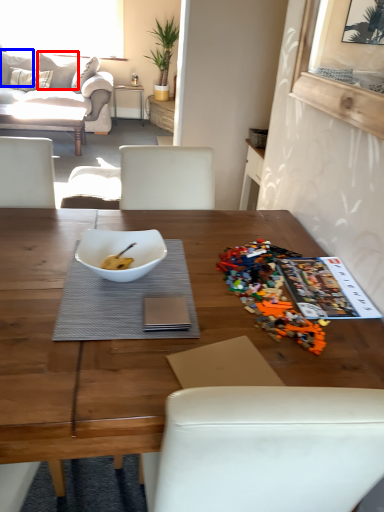
Question: Which point is further to the camera, pillow (highlighted by a red box) or pillow (highlighted by a blue box)?

Choices:
 (A) pillow
 (B) pillow

Answer: (A)